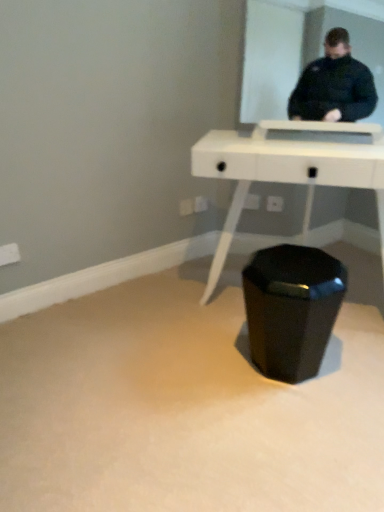
Find the location of a particular element. vacant space to the left of white glossy table at center is located at coordinates (165, 349).